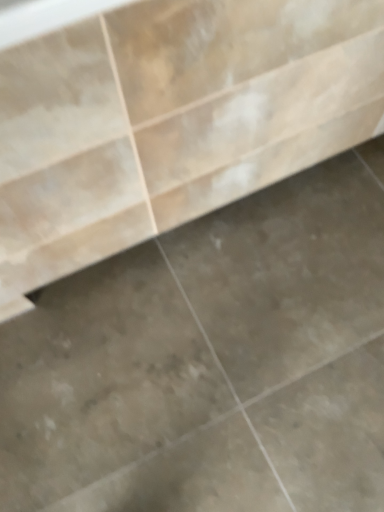
You are a GUI agent. You are given a task and a screenshot of the screen. Output one action in this format:
    pyautogui.click(x=<x>, y=<y>)
    Task: Click on the beige marble concrete at center
    
    Given the screenshot: What is the action you would take?
    pyautogui.click(x=212, y=362)

Measure the distance between beige marble concrete at center and camera.

The distance of beige marble concrete at center from camera is 34.45 inches.

What is the approximate height of beige marble concrete at center?

The height of beige marble concrete at center is 2.45 inches.

Image resolution: width=384 pixels, height=512 pixels. Describe the element at coordinates (212, 362) in the screenshot. I see `beige marble concrete at center` at that location.

Identify the location of beige marble concrete at center. The image size is (384, 512). (212, 362).